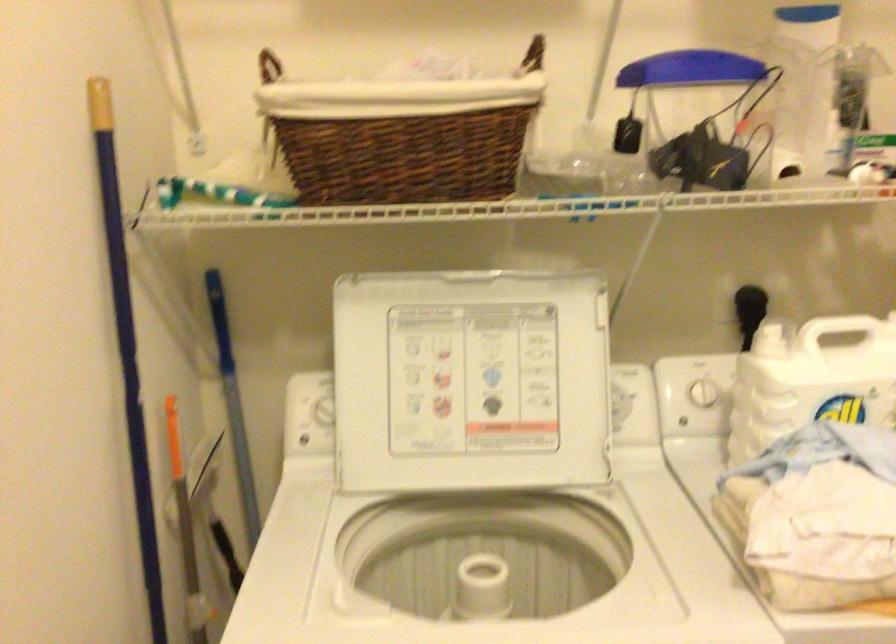
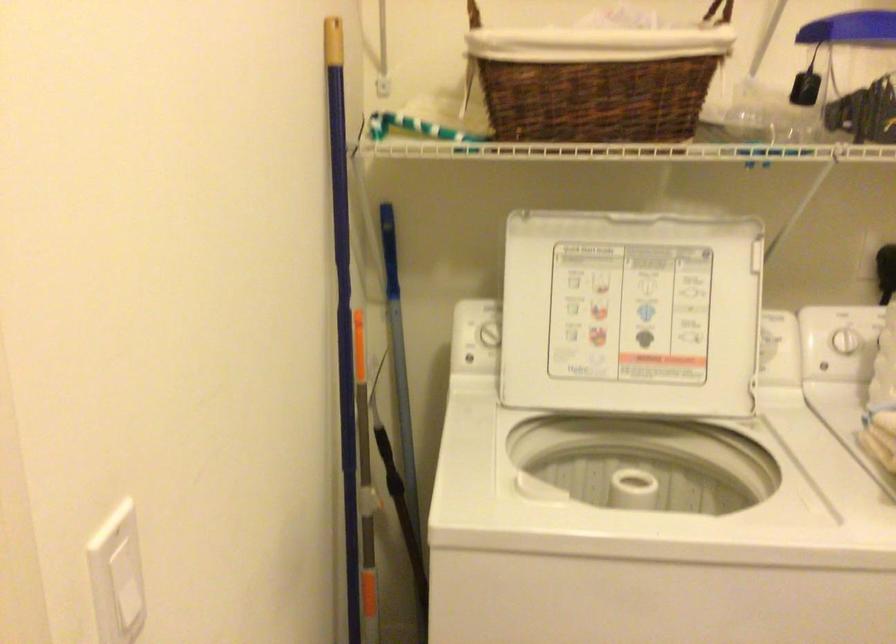
The point at (401,136) is marked in the first image. Where is the corresponding point in the second image?

(597, 79)